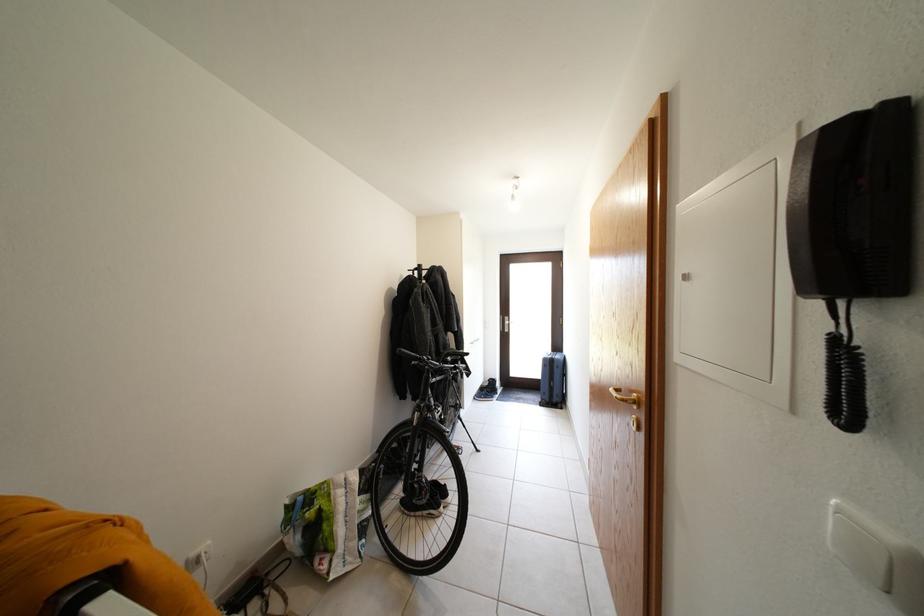
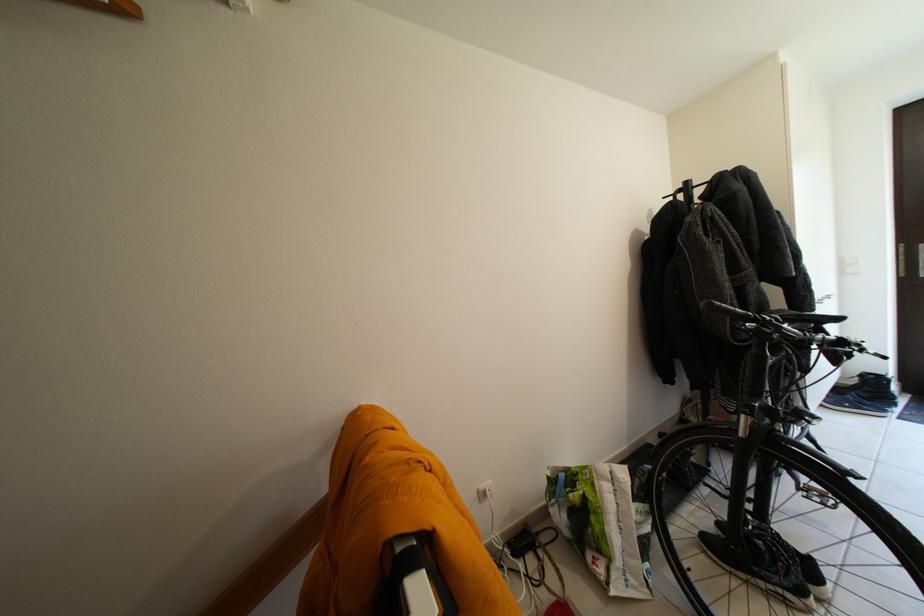
Question: The camera is either moving clockwise (left) or counter-clockwise (right) around the object. The first image is from the beginning of the video and the second image is from the end. Is the camera moving left or right when shooting the video?

Choices:
 (A) Left
 (B) Right

Answer: (B)